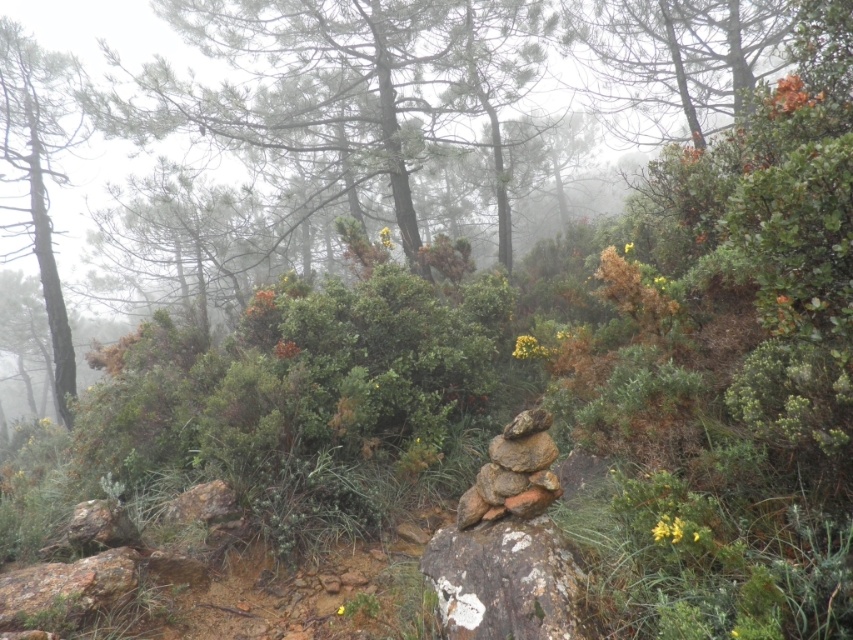
Question: Which object is positioned closest to the smooth brown tree trunk at left?

Choices:
 (A) white textured rock at center
 (B) green leafy tree at upper center

Answer: (B)

Question: Can you confirm if green leafy tree at upper center is positioned to the right of smooth brown tree trunk at left?

Choices:
 (A) no
 (B) yes

Answer: (B)

Question: Which of these objects is positioned closest to the white textured rock at center?

Choices:
 (A) green leafy tree at upper center
 (B) smooth brown tree trunk at left

Answer: (A)

Question: Is green leafy tree at upper center below smooth brown tree trunk at left?

Choices:
 (A) no
 (B) yes

Answer: (A)

Question: Which of the following is the farthest from the observer?

Choices:
 (A) (32, 140)
 (B) (527, 524)
 (C) (286, 92)

Answer: (C)

Question: Considering the relative positions of green leafy tree at upper center and white textured rock at center in the image provided, where is green leafy tree at upper center located with respect to white textured rock at center?

Choices:
 (A) below
 (B) above

Answer: (B)